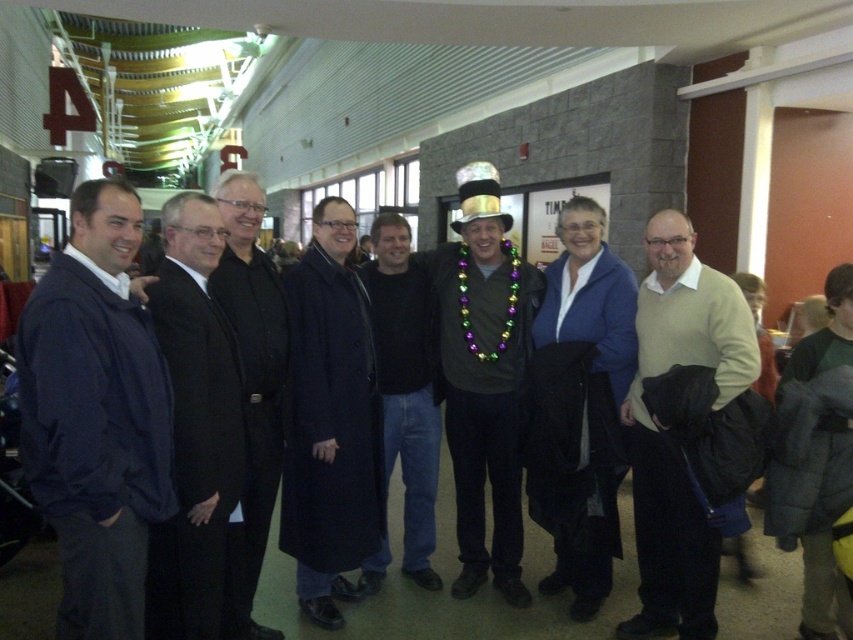
Question: Does shiny metallic top hat at center have a greater width compared to black wool coat at center?

Choices:
 (A) no
 (B) yes

Answer: (B)

Question: Considering the real-world distances, which object is closest to the black suit at center?

Choices:
 (A) dark blue jeans at center
 (B) shiny metallic top hat at center
 (C) dark blue wool coat at center

Answer: (C)

Question: Does dark blue jacket at left come behind dark blue jeans at center?

Choices:
 (A) yes
 (B) no

Answer: (B)

Question: Considering the real-world distances, which object is closest to the dark blue jeans at center?

Choices:
 (A) dark blue jacket at left
 (B) black suit at center

Answer: (B)

Question: Does dark blue jacket at left have a greater width compared to light beige sweater at center?

Choices:
 (A) no
 (B) yes

Answer: (B)

Question: Based on their relative distances, which object is nearer to the dark blue wool coat at center?

Choices:
 (A) shiny metallic top hat at center
 (B) light beige sweater at center
 (C) dark blue jeans at center

Answer: (C)